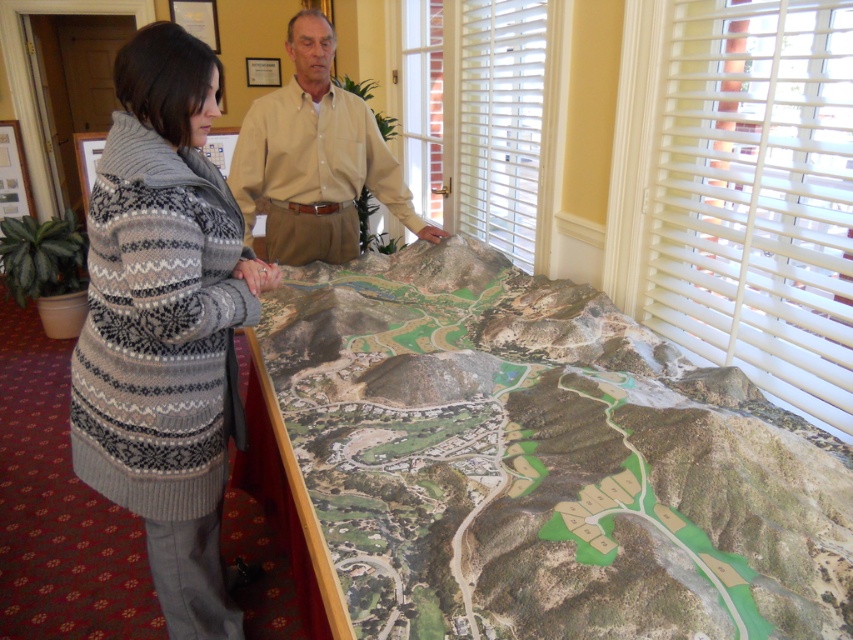
Between point (151, 180) and point (392, 172), which one is positioned in front?

Point (151, 180) is in front.

Is point (154, 273) closer to viewer compared to point (341, 241)?

Yes, point (154, 273) is in front of point (341, 241).

Who is more forward, (165, 449) or (366, 172)?

Point (165, 449) is more forward.

This screenshot has height=640, width=853. I want to click on knitted wool coat at left, so click(165, 324).

Between white plastic blinds at upper right and beige cotton shirt at upper center, which one appears on the right side from the viewer's perspective?

white plastic blinds at upper right

Which is behind, point (793, 340) or point (341, 225)?

Point (341, 225)

Image resolution: width=853 pixels, height=640 pixels. I want to click on white plastic blinds at upper right, so tap(758, 196).

Who is more distant from viewer, (x=618, y=362) or (x=306, y=20)?

Positioned behind is point (x=306, y=20).

Is point (352, 454) more distant than point (279, 132)?

No, it is not.

At what (x,y) coordinates should I click in order to perform the action: click on green textured map at center. Please return your answer as a coordinate pair (x, y). Looking at the image, I should click on (531, 465).